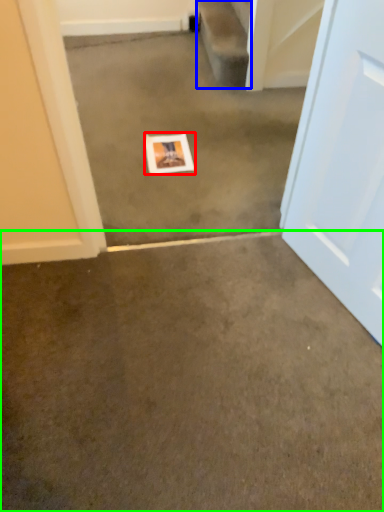
Question: Which object is the closest to the picture frame (highlighted by a red box)? Choose among these: stairwell (highlighted by a blue box) or concrete (highlighted by a green box).

Choices:
 (A) stairwell
 (B) concrete

Answer: (A)